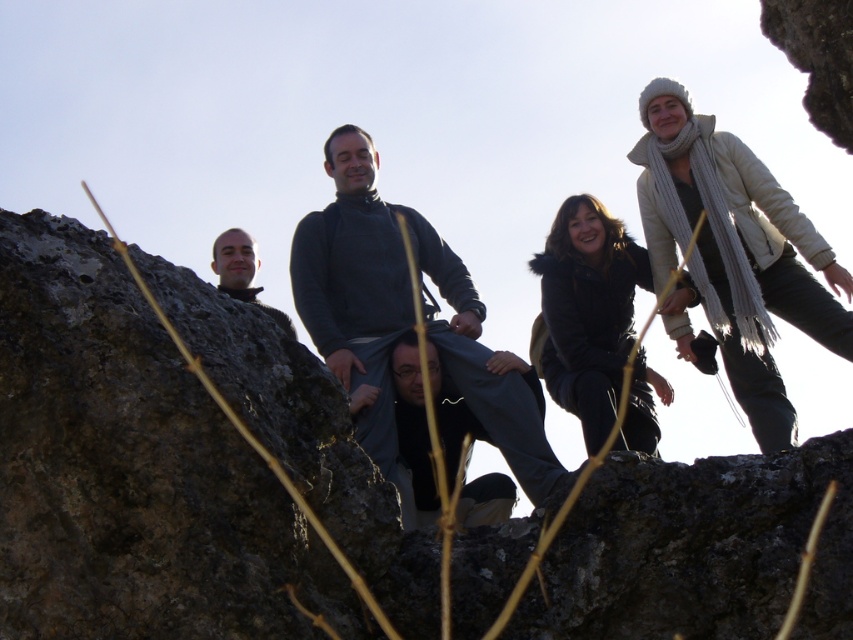
You are part of the hiking group in the image and want to pass a small package from the person with the white knitted hat at upper right to the person wearing the dark gray sweater at center. Can you do this without leaving your current position?

Yes, because the white knitted hat at upper right is closer to you than the dark gray sweater at center, so you can pass the package directly between them without moving.

You are a photographer trying to capture a photo of the dark gray sweater at center and the white knitted hat at upper right. Which object should you zoom in on to focus on the smaller one?

The white knitted hat at upper right is smaller than the dark gray sweater at center, so you should zoom in on the white knitted hat at upper right to focus on the smaller one.

In the scene shown: You are a photographer trying to capture a photo of the black fuzzy coat at center and the white knitted hat at upper right. Since you want both subjects to be in focus, you need to know which one is taller. Can you determine which is taller?

The white knitted hat at upper right is much taller than the black fuzzy coat at center, so you should focus on the white knitted hat at upper right first to ensure both are in focus.